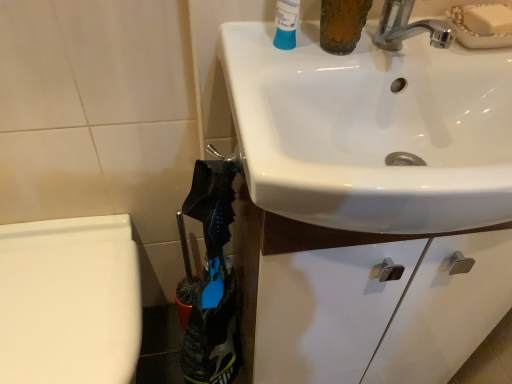
What are the coordinates of `white glossy bidet at lower left` in the screenshot? It's located at (69, 301).

The width and height of the screenshot is (512, 384). Describe the element at coordinates (69, 301) in the screenshot. I see `white glossy bidet at lower left` at that location.

Measure the distance between point (111, 252) and camera.

Point (111, 252) is 86.30 centimeters from camera.

What is the approximate height of white glossy sink at upper right?

white glossy sink at upper right is 6.24 inches tall.

Image resolution: width=512 pixels, height=384 pixels. What do you see at coordinates (372, 131) in the screenshot? I see `white glossy sink at upper right` at bounding box center [372, 131].

The width and height of the screenshot is (512, 384). What are the coordinates of `white glossy sink at upper right` in the screenshot? It's located at (372, 131).

Find the location of a particular element. The height and width of the screenshot is (384, 512). white glossy bidet at lower left is located at coordinates (69, 301).

Considering the positions of objects white glossy bidet at lower left and white glossy sink at upper right in the image provided, who is more to the left, white glossy bidet at lower left or white glossy sink at upper right?

white glossy bidet at lower left is more to the left.

Relative to white glossy sink at upper right, is white glossy bidet at lower left in front or behind?

white glossy bidet at lower left is behind white glossy sink at upper right.

Is point (8, 325) farther from camera compared to point (480, 187)?

Yes, it is.

From the image's perspective, is white glossy bidet at lower left on top of white glossy sink at upper right?

No, from the image's perspective, white glossy bidet at lower left is not above white glossy sink at upper right.

From a real-world perspective, who is located lower, white glossy bidet at lower left or white glossy sink at upper right?

white glossy bidet at lower left, from a real-world perspective.

Considering the sizes of objects white glossy bidet at lower left and white glossy sink at upper right in the image provided, who is wider, white glossy bidet at lower left or white glossy sink at upper right?

white glossy sink at upper right is wider.

Considering the relative sizes of white glossy bidet at lower left and white glossy sink at upper right in the image provided, is white glossy bidet at lower left shorter than white glossy sink at upper right?

No.

In terms of size, does white glossy bidet at lower left appear bigger or smaller than white glossy sink at upper right?

white glossy bidet at lower left is bigger than white glossy sink at upper right.

Would you say white glossy bidet at lower left is inside or outside white glossy sink at upper right?

white glossy bidet at lower left exists outside the volume of white glossy sink at upper right.

Are white glossy bidet at lower left and white glossy sink at upper right beside each other?

No, white glossy bidet at lower left is not making contact with white glossy sink at upper right.

Consider the image. Is white glossy bidet at lower left oriented away from white glossy sink at upper right?

No, white glossy bidet at lower left's orientation is not away from white glossy sink at upper right.

Find the location of `bidet on the left side of white glossy sink at upper right`. bidet on the left side of white glossy sink at upper right is located at coordinates (69, 301).

Considering the relative positions of white glossy sink at upper right and white glossy bidet at lower left in the image provided, is white glossy sink at upper right to the right of white glossy bidet at lower left from the viewer's perspective?

Yes.

Considering the relative positions of white glossy sink at upper right and white glossy bidet at lower left in the image provided, is white glossy sink at upper right behind white glossy bidet at lower left?

That is False.

Is point (387, 181) closer or farther from the camera than point (76, 276)?

Point (387, 181) is closer to the camera than point (76, 276).

From the image's perspective, is white glossy sink at upper right over white glossy bidet at lower left?

Yes, from the image's perspective, white glossy sink at upper right is over white glossy bidet at lower left.

From a real-world perspective, is white glossy sink at upper right on white glossy bidet at lower left?

Yes.

Considering the sizes of white glossy sink at upper right and white glossy bidet at lower left in the image, is white glossy sink at upper right wider or thinner than white glossy bidet at lower left?

white glossy sink at upper right is wider than white glossy bidet at lower left.

Considering the sizes of objects white glossy sink at upper right and white glossy bidet at lower left in the image provided, who is taller, white glossy sink at upper right or white glossy bidet at lower left?

With more height is white glossy bidet at lower left.

Can you confirm if white glossy sink at upper right is bigger than white glossy bidet at lower left?

Actually, white glossy sink at upper right might be smaller than white glossy bidet at lower left.

Is white glossy bidet at lower left inside white glossy sink at upper right?

That's incorrect, white glossy bidet at lower left is not inside white glossy sink at upper right.

Consider the image. Is white glossy sink at upper right beside white glossy bidet at lower left?

No, white glossy sink at upper right is not in contact with white glossy bidet at lower left.

Is white glossy sink at upper right oriented towards white glossy bidet at lower left?

No, white glossy sink at upper right is not facing towards white glossy bidet at lower left.

How many degrees apart are the facing directions of white glossy sink at upper right and white glossy bidet at lower left?

They differ by 1.26 degrees in their facing directions.

How much distance is there between white glossy sink at upper right and white glossy bidet at lower left?

A distance of 20.69 inches exists between white glossy sink at upper right and white glossy bidet at lower left.

Identify the location of bidet on the left of the white glossy sink at upper right. (69, 301).

You are a GUI agent. You are given a task and a screenshot of the screen. Output one action in this format:
    pyautogui.click(x=<x>, y=<y>)
    Task: Click on the sink on the right of the white glossy bidet at lower left
    Image resolution: width=512 pixels, height=384 pixels.
    Given the screenshot: What is the action you would take?
    pyautogui.click(x=372, y=131)

Where is `sink above the white glossy bidet at lower left (from the image's perspective)`? The height and width of the screenshot is (384, 512). sink above the white glossy bidet at lower left (from the image's perspective) is located at coordinates (372, 131).